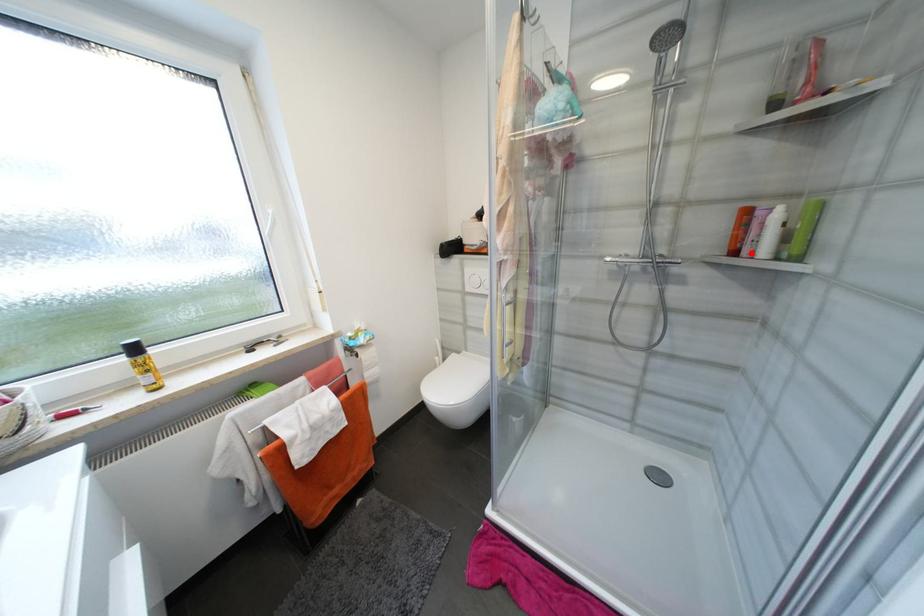
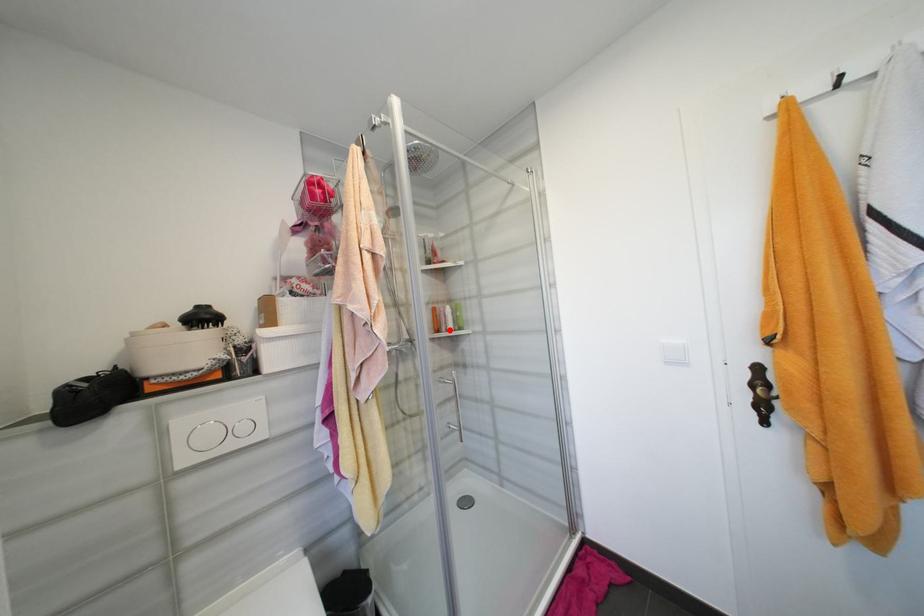
I am providing you with two images of the same scene from different viewpoints. A red point is marked on the first image and another point is marked on the second image. Do the highlighted points in image1 and image2 indicate the same real-world spot?

Yes